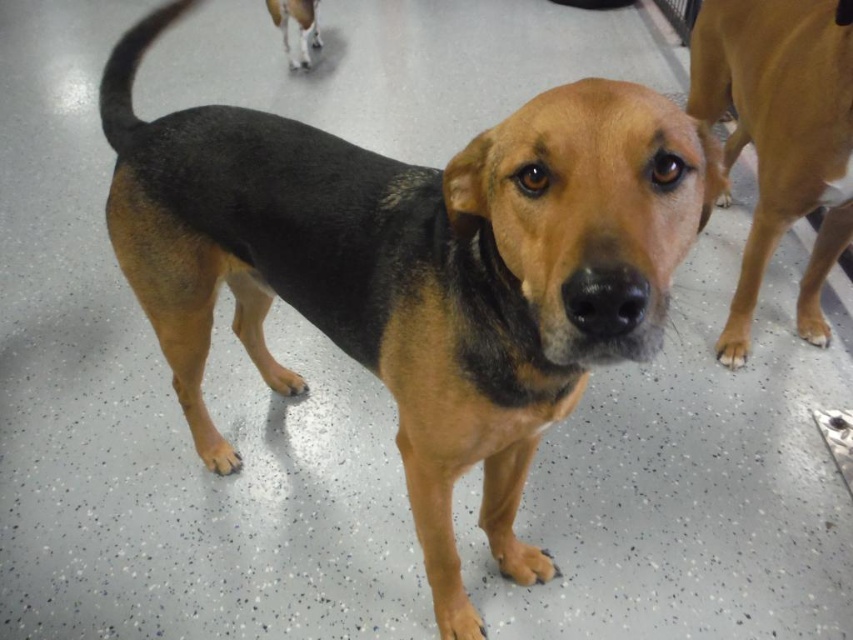
Question: Which is farther from the brown matte fur at right?

Choices:
 (A) white fur at upper center
 (B) brown fur dog at center

Answer: (A)

Question: Does brown fur dog at center have a smaller size compared to white fur at upper center?

Choices:
 (A) no
 (B) yes

Answer: (A)

Question: Does brown matte fur at right have a greater width compared to white fur at upper center?

Choices:
 (A) yes
 (B) no

Answer: (A)

Question: Which object is the farthest from the brown fur dog at center?

Choices:
 (A) white fur at upper center
 (B) brown matte fur at right

Answer: (A)

Question: Can you confirm if brown fur dog at center is positioned to the right of white fur at upper center?

Choices:
 (A) no
 (B) yes

Answer: (B)

Question: Among these points, which one is nearest to the camera?

Choices:
 (A) (766, 243)
 (B) (299, 64)
 (C) (505, 125)

Answer: (C)